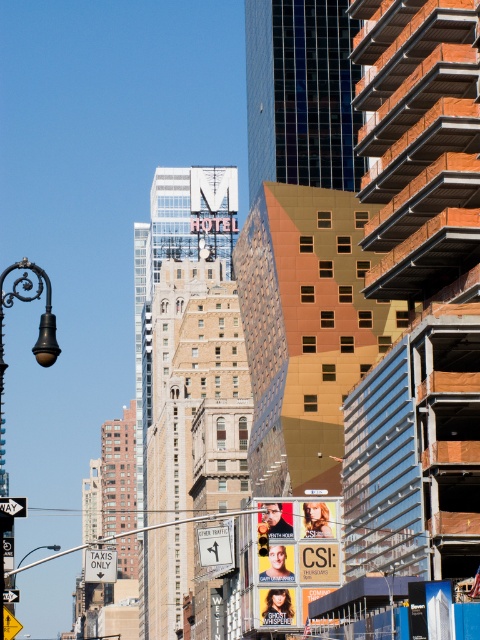
Question: Is black metal lamp post at left wider than white plastic street sign at upper center?

Choices:
 (A) yes
 (B) no

Answer: (A)

Question: Which of these objects is positioned farthest from the black metal lamp post at left?

Choices:
 (A) metallic gold billboard at center
 (B) white plastic street sign at upper center

Answer: (A)

Question: Does black metal lamp post at left come behind white plastic street sign at upper center?

Choices:
 (A) yes
 (B) no

Answer: (B)

Question: Based on their relative distances, which object is farther from the black metal lamp post at left?

Choices:
 (A) metallic gold billboard at center
 (B) white plastic street sign at upper center

Answer: (A)

Question: Which object is closer to the camera taking this photo?

Choices:
 (A) black metal lamp post at left
 (B) white plastic street sign at upper center

Answer: (A)

Question: Is black metal lamp post at left closer to camera compared to white plastic street sign at upper center?

Choices:
 (A) yes
 (B) no

Answer: (A)